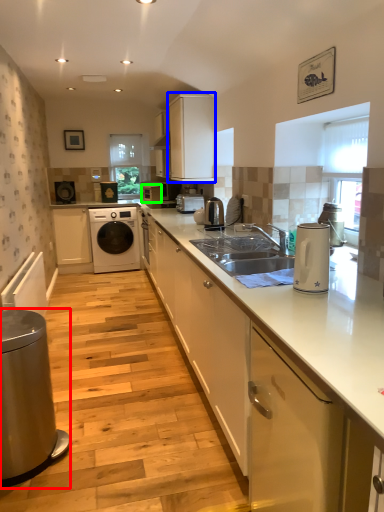
Question: Based on their relative distances, which object is farther from home appliance (highlighted by a red box)? Choose from cabinetry (highlighted by a blue box) and appliance (highlighted by a green box).

Choices:
 (A) cabinetry
 (B) appliance

Answer: (B)